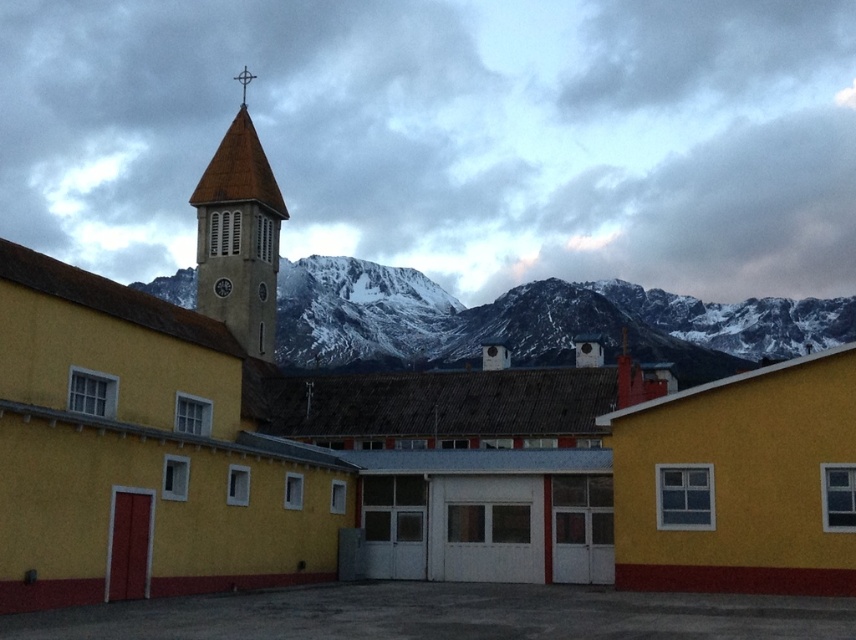
Question: Can you confirm if snowy rock formation at upper center is positioned to the right of brown tiled bell tower at upper left?

Choices:
 (A) no
 (B) yes

Answer: (B)

Question: Where is snowy rock formation at upper center located in relation to brown tiled bell tower at upper left in the image?

Choices:
 (A) above
 (B) below

Answer: (B)

Question: Which point is closer to the camera?

Choices:
 (A) (214, 317)
 (B) (321, 291)

Answer: (A)

Question: Which point is farther to the camera?

Choices:
 (A) (384, 328)
 (B) (224, 200)

Answer: (A)

Question: Is snowy rock formation at upper center positioned before brown tiled bell tower at upper left?

Choices:
 (A) no
 (B) yes

Answer: (A)